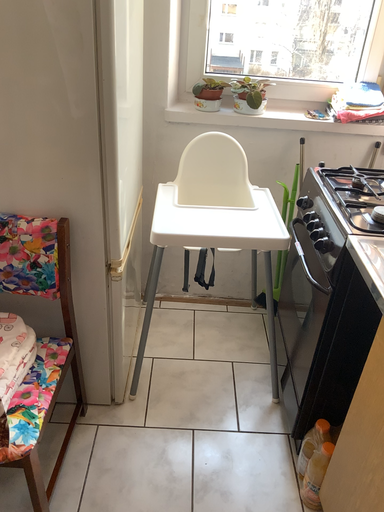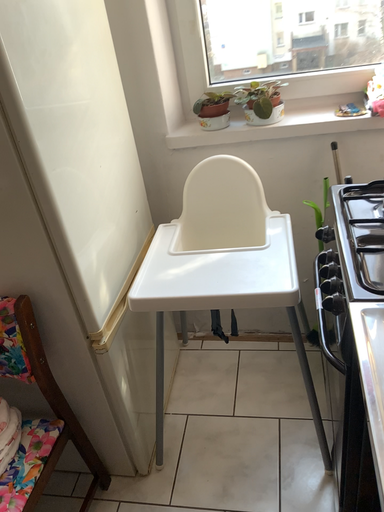
Question: Which way did the camera rotate in the video?

Choices:
 (A) rotated right
 (B) rotated left

Answer: (B)